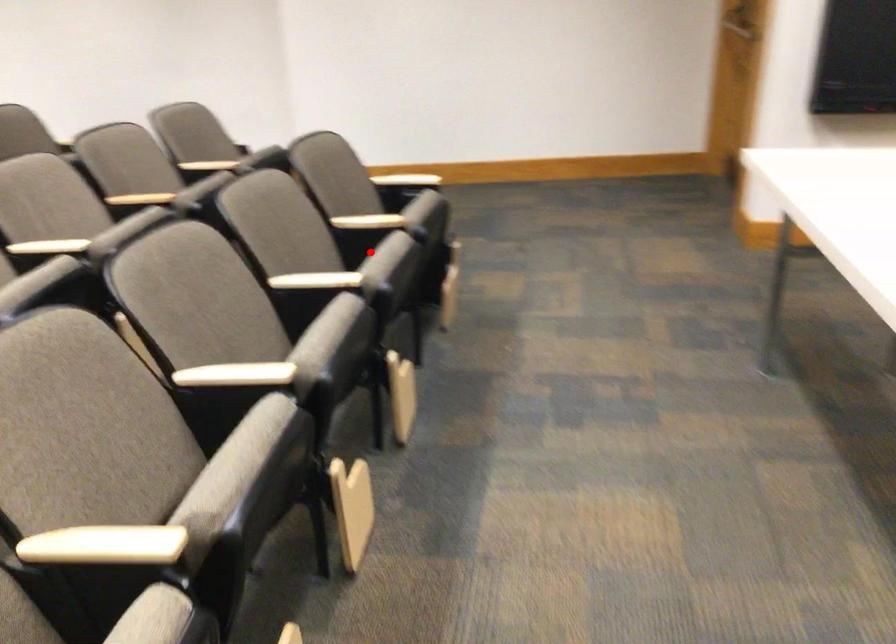
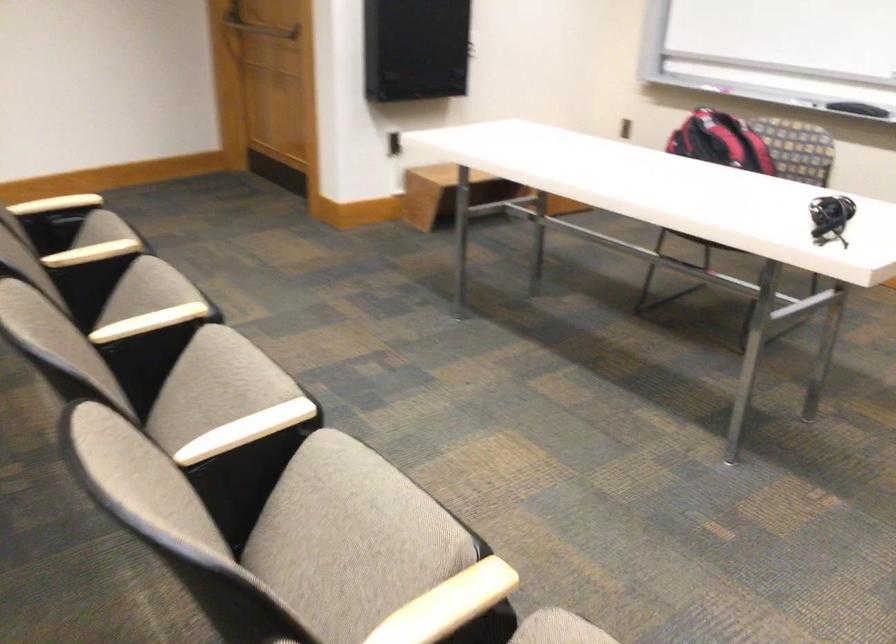
Question: I am providing you with two images of the same scene from different viewpoints. In image1, a red point is highlighted. Considering the same 3D point in image2, which of the following is correct?

Choices:
 (A) It is closer
 (B) It is farther

Answer: (A)